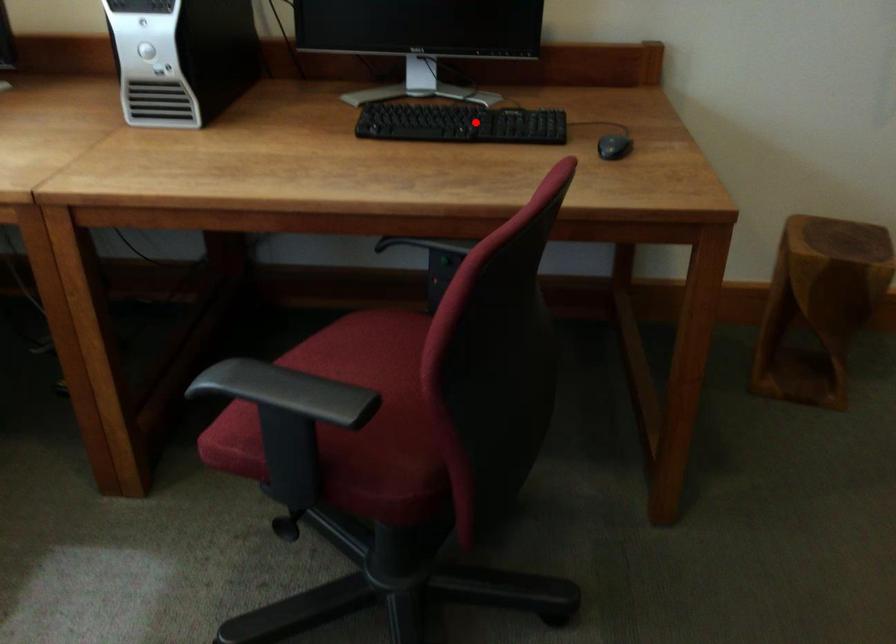
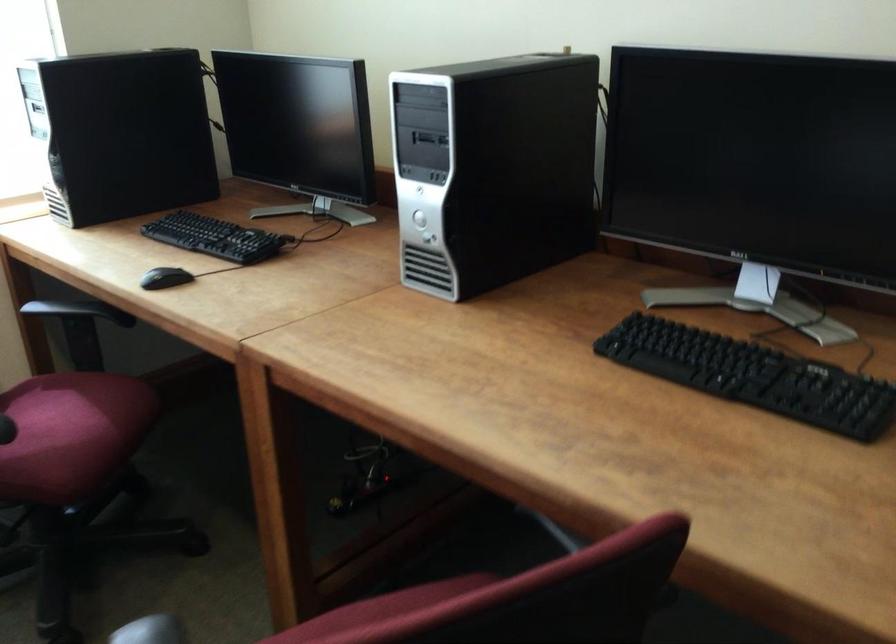
The point at the highlighted location is marked in the first image. Where is the corresponding point in the second image?

(753, 375)